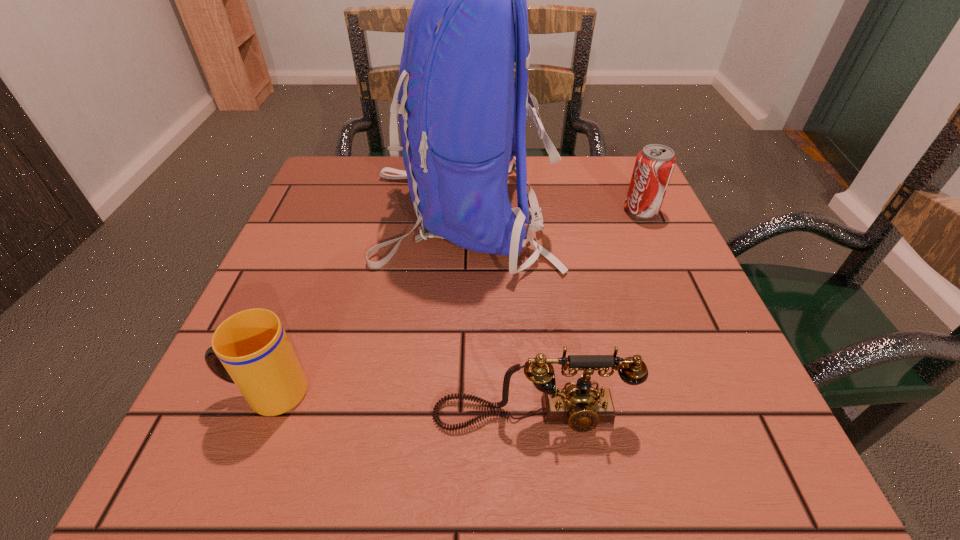
The height and width of the screenshot is (540, 960). Find the location of `backpack that is at the left edge`. backpack that is at the left edge is located at coordinates (462, 120).

The width and height of the screenshot is (960, 540). I want to click on cup that is positioned at the left edge, so click(x=251, y=349).

Identify the location of object situated at the right edge. (654, 165).

The width and height of the screenshot is (960, 540). I want to click on object situated at the far left corner, so click(x=462, y=120).

The width and height of the screenshot is (960, 540). Identify the location of object that is positioned at the far right corner. (654, 165).

The height and width of the screenshot is (540, 960). In the image, there is a desktop. Find the location of `free space at the far edge`. free space at the far edge is located at coordinates (399, 206).

The width and height of the screenshot is (960, 540). In the image, there is a desktop. What are the coordinates of `vacant space at the left edge` in the screenshot? It's located at point(300,264).

In order to click on blank space at the right edge of the desktop in this screenshot , I will do `click(660, 333)`.

In the image, there is a desktop. Identify the location of vacant space at the far left corner. (370, 190).

This screenshot has width=960, height=540. I want to click on vacant space at the near left corner of the desktop, so click(x=192, y=485).